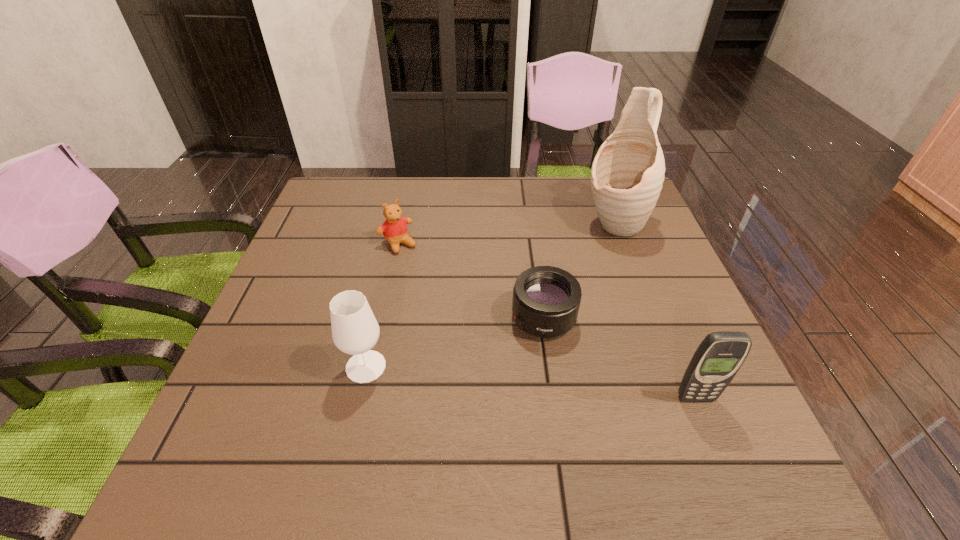
Find the location of a particular element. The height and width of the screenshot is (540, 960). pitcher present at the right edge is located at coordinates (627, 174).

Where is `object that is at the far right corner`? The height and width of the screenshot is (540, 960). object that is at the far right corner is located at coordinates (627, 174).

What are the coordinates of `object at the near right corner` in the screenshot? It's located at [x=720, y=355].

In order to click on free point at the far edge in this screenshot , I will do coord(414,218).

In the image, there is a desktop. Identify the location of vacant space at the near edge. Image resolution: width=960 pixels, height=540 pixels. (464, 399).

At what (x,y) coordinates should I click in order to perform the action: click on free space at the left edge of the desktop. Please return your answer as a coordinate pair (x, y). The height and width of the screenshot is (540, 960). Looking at the image, I should click on (296, 276).

Where is `vacant space at the right edge of the desktop`? The height and width of the screenshot is (540, 960). vacant space at the right edge of the desktop is located at coordinates (644, 350).

Where is `free space at the far left corner of the desktop`? free space at the far left corner of the desktop is located at coordinates (370, 197).

Image resolution: width=960 pixels, height=540 pixels. In the image, there is a desktop. Find the location of `blank space at the near left corner`. blank space at the near left corner is located at coordinates (x=261, y=390).

Locate an element on the screen. This screenshot has width=960, height=540. free space at the far right corner is located at coordinates (584, 180).